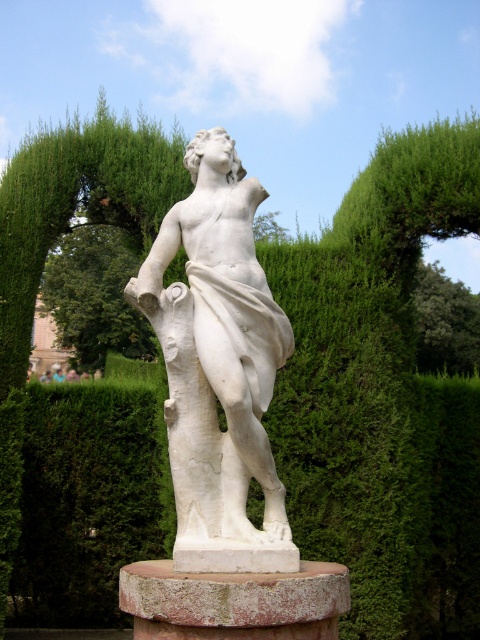
Consider the image. How far apart are green leafy tree at center and green leafy tree at upper center?

green leafy tree at center and green leafy tree at upper center are 8.44 meters apart.

The image size is (480, 640). What do you see at coordinates (95, 296) in the screenshot?
I see `green leafy tree at center` at bounding box center [95, 296].

Does point (117, 284) come farther from viewer compared to point (434, 296)?

No, it is in front of (434, 296).

The image size is (480, 640). Identify the location of green leafy tree at center. (95, 296).

The height and width of the screenshot is (640, 480). What do you see at coordinates (217, 365) in the screenshot?
I see `white marble statue at center` at bounding box center [217, 365].

Does white marble statue at center appear on the left side of green leafy tree at upper center?

Indeed, white marble statue at center is positioned on the left side of green leafy tree at upper center.

I want to click on white marble statue at center, so click(217, 365).

This screenshot has width=480, height=640. What are the coordinates of `white marble statue at center` in the screenshot? It's located at (217, 365).

Which of these two, white marble statue at center or green leafy tree at center, stands taller?

Standing taller between the two is white marble statue at center.

The image size is (480, 640). Describe the element at coordinates (217, 365) in the screenshot. I see `white marble statue at center` at that location.

At what (x,y) coordinates should I click in order to perform the action: click on white marble statue at center. Please return your answer as a coordinate pair (x, y). This screenshot has height=640, width=480. Looking at the image, I should click on (217, 365).